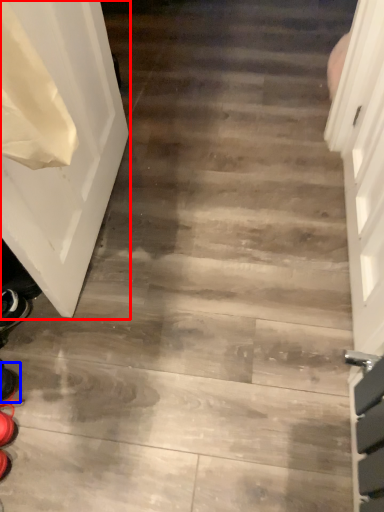
Question: Which object is closer to the camera taking this photo, door (highlighted by a red box) or shoe (highlighted by a blue box)?

Choices:
 (A) door
 (B) shoe

Answer: (A)